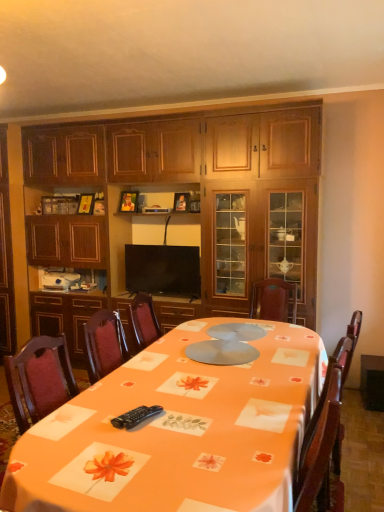
Question: Is orange fabric table at center to the left of flat screen tv at center from the viewer's perspective?

Choices:
 (A) yes
 (B) no

Answer: (B)

Question: Is flat screen tv at center surrounded by orange fabric table at center?

Choices:
 (A) yes
 (B) no

Answer: (B)

Question: Are orange fabric table at center and flat screen tv at center located far from each other?

Choices:
 (A) no
 (B) yes

Answer: (B)

Question: Is orange fabric table at center facing towards flat screen tv at center?

Choices:
 (A) yes
 (B) no

Answer: (B)

Question: Can you confirm if orange fabric table at center is bigger than flat screen tv at center?

Choices:
 (A) no
 (B) yes

Answer: (B)

Question: Is orange fabric table at center completely or partially outside of flat screen tv at center?

Choices:
 (A) yes
 (B) no

Answer: (A)

Question: From a real-world perspective, does black plastic remote control at lower center sit lower than orange fabric table at center?

Choices:
 (A) yes
 (B) no

Answer: (B)

Question: Is black plastic remote control at lower center far from orange fabric table at center?

Choices:
 (A) no
 (B) yes

Answer: (A)

Question: From a real-world perspective, is black plastic remote control at lower center on orange fabric table at center?

Choices:
 (A) yes
 (B) no

Answer: (A)

Question: Is black plastic remote control at lower center next to orange fabric table at center and touching it?

Choices:
 (A) yes
 (B) no

Answer: (B)

Question: Is black plastic remote control at lower center wider than orange fabric table at center?

Choices:
 (A) no
 (B) yes

Answer: (A)

Question: Considering the relative positions of black plastic remote control at lower center and orange fabric table at center in the image provided, is black plastic remote control at lower center to the right of orange fabric table at center from the viewer's perspective?

Choices:
 (A) yes
 (B) no

Answer: (B)

Question: Considering the relative positions of black plastic remote control at lower center and flat screen tv at center in the image provided, is black plastic remote control at lower center in front of flat screen tv at center?

Choices:
 (A) yes
 (B) no

Answer: (A)